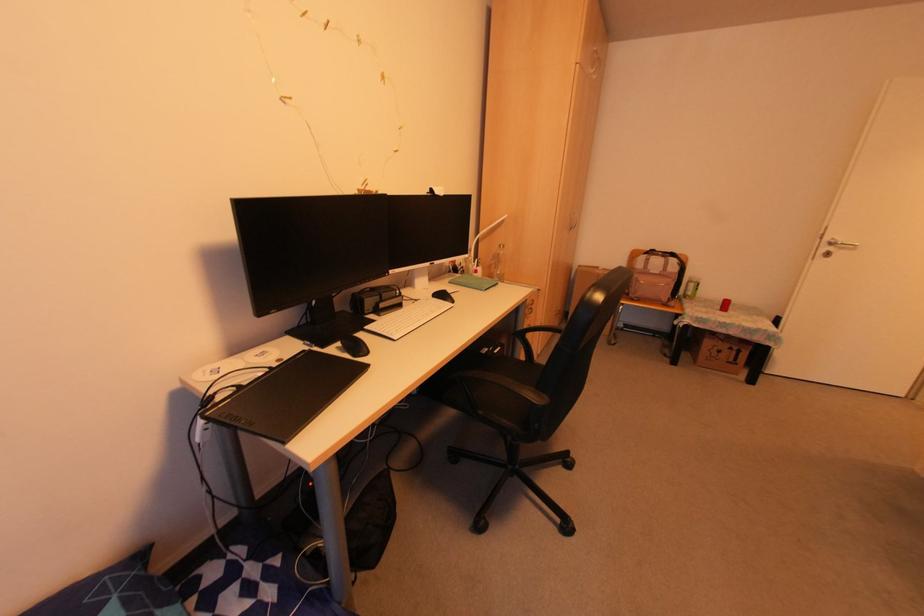
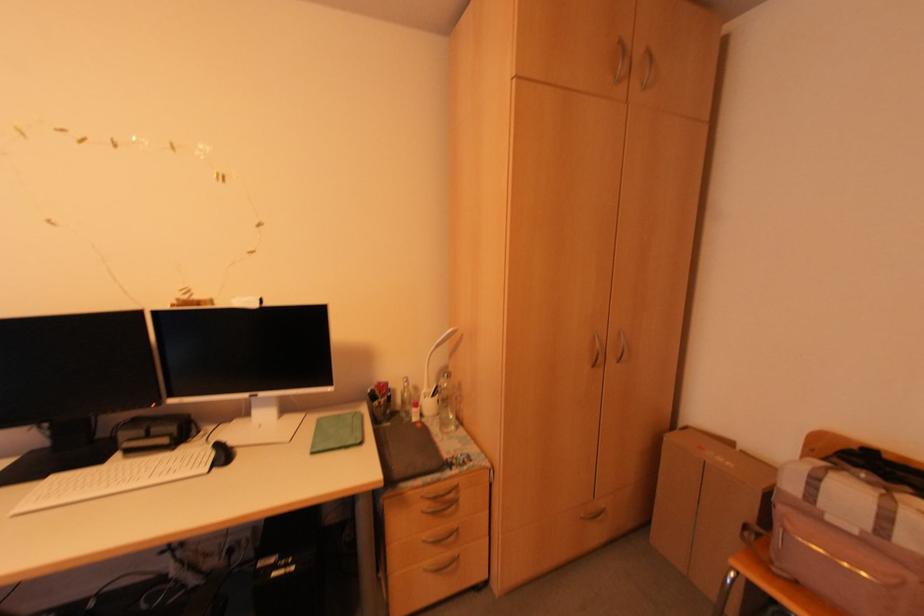
In the second image, find the point that corresponds to (x=556, y=310) in the first image.

(602, 506)